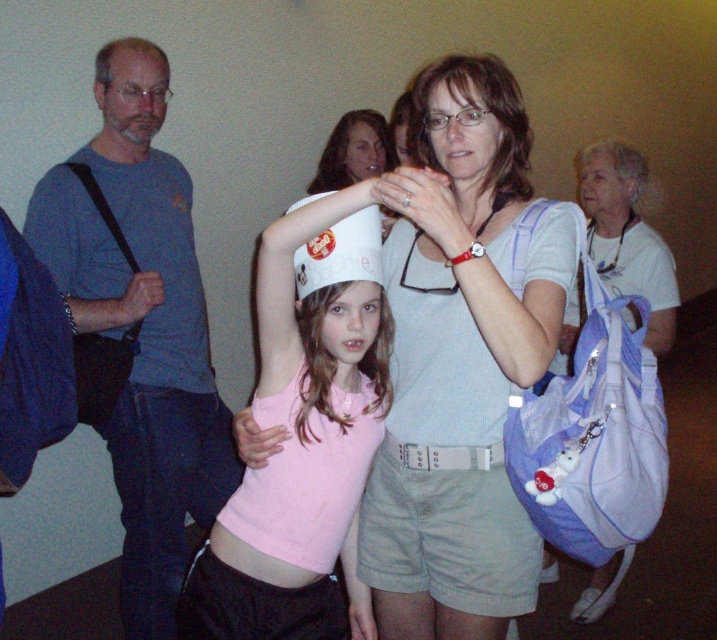
Question: Is matte white hat at center in front of matte white paper crown at center?

Choices:
 (A) yes
 (B) no

Answer: (A)

Question: Among these points, which one is nearest to the camera?

Choices:
 (A) (153, 51)
 (B) (424, 86)
 (C) (397, 106)
 (D) (199, 625)

Answer: (D)

Question: Estimate the real-world distances between objects in this image. Which object is farther from the matte white shirt at center?

Choices:
 (A) matte white hat at center
 (B) matte white paper crown at center
 (C) gray hair at upper left

Answer: (C)

Question: Can you confirm if pink matte tank top at center is positioned above white fabric headband at upper right?

Choices:
 (A) yes
 (B) no

Answer: (B)

Question: Does matte white shirt at center lie in front of matte white hat at center?

Choices:
 (A) yes
 (B) no

Answer: (A)

Question: Which point is closer to the camera taking this photo?

Choices:
 (A) (452, 636)
 (B) (115, 134)
 (C) (318, 529)
 (D) (450, 93)

Answer: (D)